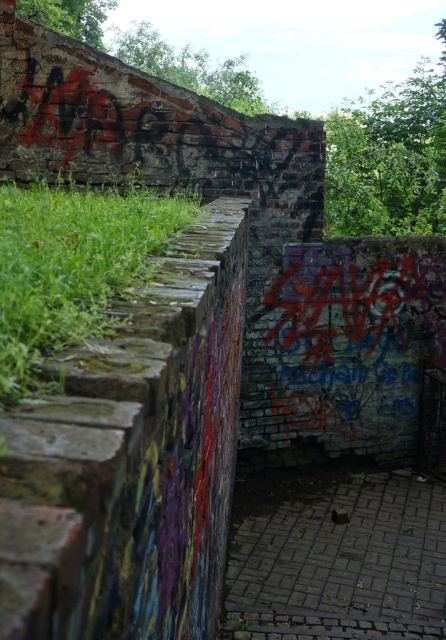
Is dark brick path at center closer to the viewer compared to green mossy wall at left?

No, it is behind green mossy wall at left.

Is point (252, 563) farther from viewer compared to point (169, 195)?

No.

Image resolution: width=446 pixels, height=640 pixels. In order to click on dark brick path at center in this screenshot , I will do `click(338, 557)`.